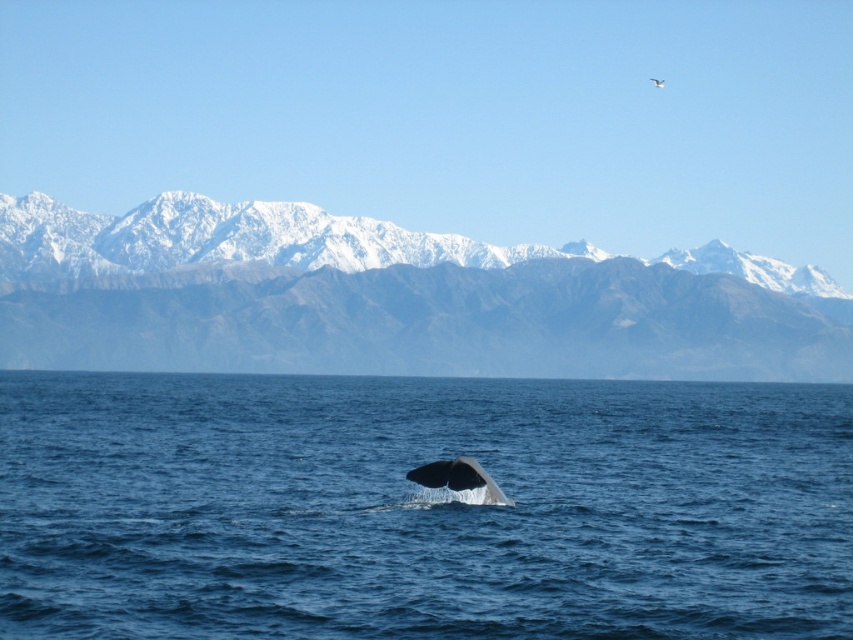
Question: Does blue water at center have a smaller size compared to gray smooth whale at center?

Choices:
 (A) yes
 (B) no

Answer: (B)

Question: Which point is closer to the camera?

Choices:
 (A) (469, 616)
 (B) (422, 481)

Answer: (A)

Question: Which object is the closest to the blue water at center?

Choices:
 (A) snowy gray mountain range at upper center
 (B) gray smooth whale at center

Answer: (A)

Question: Which point is farther to the camera?

Choices:
 (A) snowy gray mountain range at upper center
 (B) gray smooth whale at center

Answer: (A)

Question: In this image, where is blue water at center located relative to gray smooth whale at center?

Choices:
 (A) below
 (B) above

Answer: (A)

Question: Can you confirm if blue water at center is thinner than snowy gray mountain range at upper center?

Choices:
 (A) no
 (B) yes

Answer: (B)